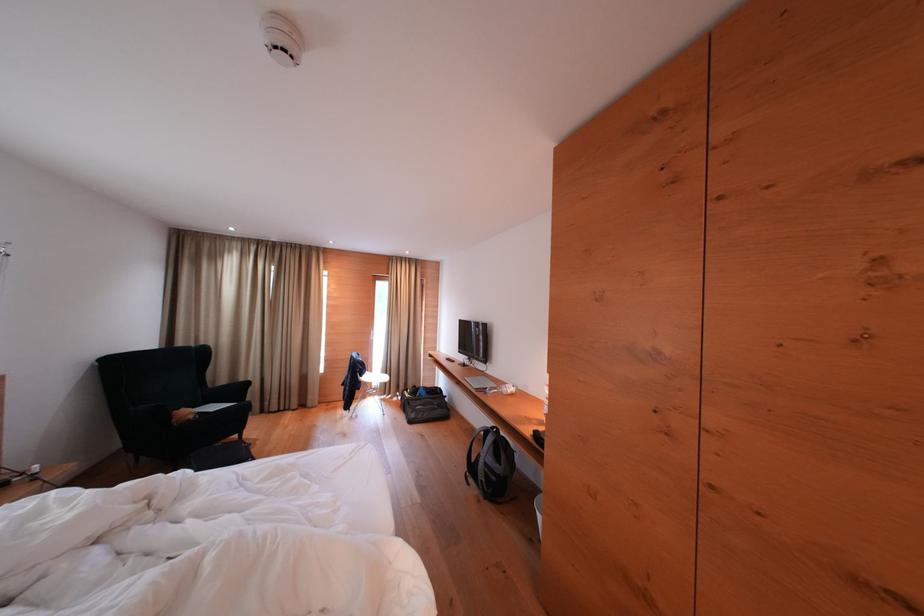
Which object does [490,464] point to?

It refers to a black travel bag.